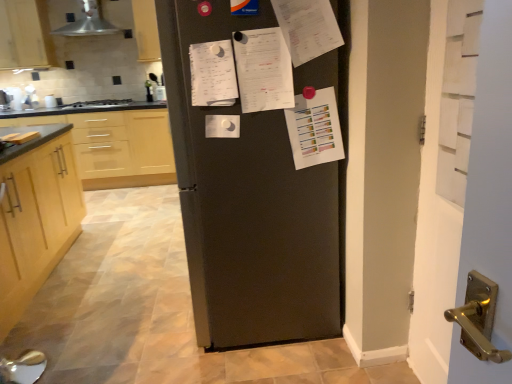
What are the coordinates of `vacant point to the left of matte black fridge at center` in the screenshot? It's located at (131, 314).